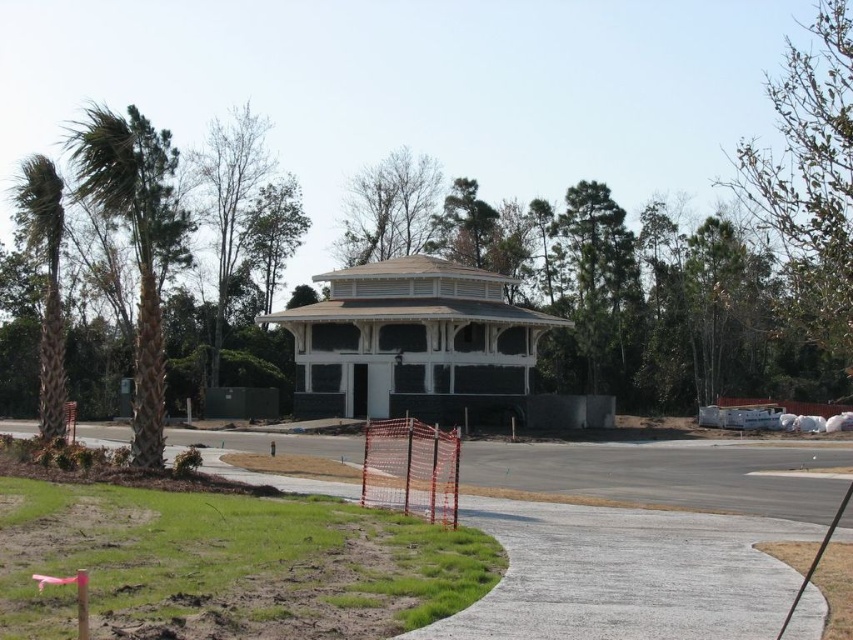
Is point (798, 284) closer to viewer compared to point (172, 256)?

Yes, point (798, 284) is in front of point (172, 256).

Between point (751, 173) and point (97, 136), which one is positioned behind?

The point (751, 173) is behind.

Which is in front, point (837, 140) or point (79, 176)?

Point (837, 140) is more forward.

This screenshot has height=640, width=853. Identify the location of bare branches at upper right. (810, 177).

Is white wood gazebo at center closer to camera compared to bare branches at upper right?

No, it is not.

Between point (413, 294) and point (825, 209), which one is positioned in front?

Point (825, 209) is in front.

Where is `white wood gazebo at center`? The height and width of the screenshot is (640, 853). white wood gazebo at center is located at coordinates (413, 342).

Can you confirm if white wood gazebo at center is positioned above green leafy palm tree at left?

Actually, white wood gazebo at center is below green leafy palm tree at left.

Who is higher up, white wood gazebo at center or green leafy palm tree at left?

Positioned higher is green leafy palm tree at left.

Does point (523, 364) lie behind point (62, 428)?

Yes, point (523, 364) is behind point (62, 428).

At what (x,y) coordinates should I click in order to perform the action: click on white wood gazebo at center. Please return your answer as a coordinate pair (x, y). The width and height of the screenshot is (853, 640). Looking at the image, I should click on (413, 342).